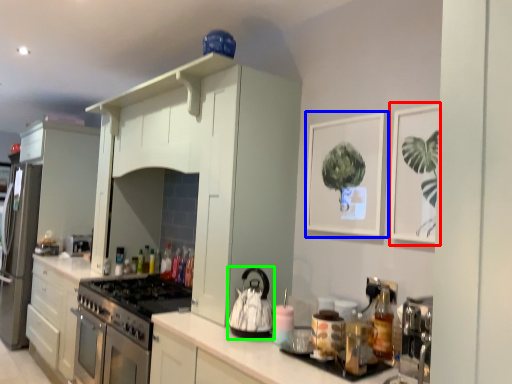
Question: Which is farther away from picture frame (highlighted by a red box)? picture frame (highlighted by a blue box) or kitchen appliance (highlighted by a green box)?

Choices:
 (A) picture frame
 (B) kitchen appliance

Answer: (B)